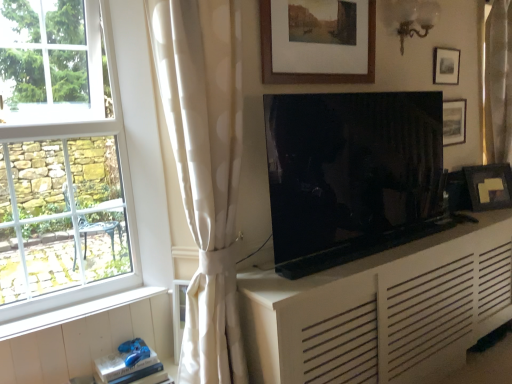
Question: From a real-world perspective, is white matte cabinet at center positioned above or below white glass window at left?

Choices:
 (A) above
 (B) below

Answer: (B)

Question: From the image's perspective, is white matte cabinet at center located above or below white glass window at left?

Choices:
 (A) above
 (B) below

Answer: (B)

Question: Considering the real-world distances, which object is farthest from the white matte cabinet at center?

Choices:
 (A) matte black picture frame at upper right, which ranks as the 3th picture frame in back-to-front order
 (B) gold fabric curtain at right, which appears as the first curtain when viewed from the back
 (C) wooden picture frame at upper right, placed as the third picture frame when sorted from front to back
 (D) white wood at lower left
 (E) matte black picture frame at right, the fourth picture frame in the front-to-back sequence

Answer: (B)

Question: Which of these objects is positioned farthest from the white glass window at left?

Choices:
 (A) wooden picture frame at upper right, marked as the 3th picture frame in a left-to-right arrangement
 (B) matte black tv at center
 (C) gold fabric curtain at right, which appears as the first curtain when viewed from the back
 (D) white wood at lower left
 (E) wooden framed picture at upper center, the 4th picture frame from the back

Answer: (C)